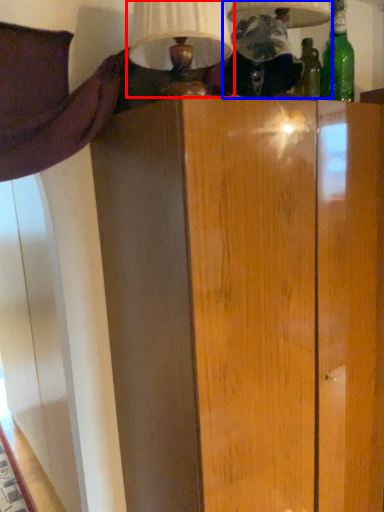
Question: Among these objects, which one is farthest to the camera, table lamp (highlighted by a red box) or table lamp (highlighted by a blue box)?

Choices:
 (A) table lamp
 (B) table lamp

Answer: (B)